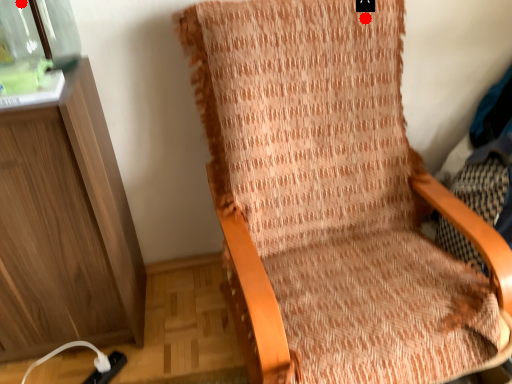
Question: Two points are circled on the image, labeled by A and B beside each circle. Which of the following is the farthest from the observer?

Choices:
 (A) A is further
 (B) B is further

Answer: (A)